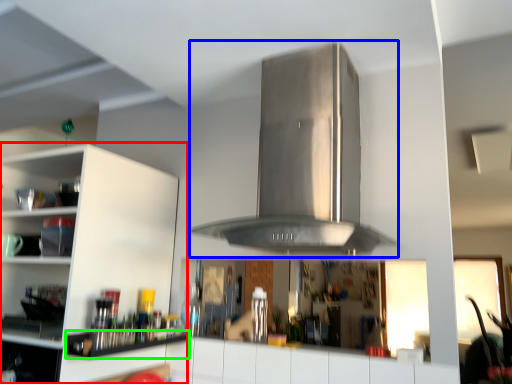
Question: Which is nearer to the cabinetry (highlighted by a red box)? vent (highlighted by a blue box) or shelf (highlighted by a green box).

Choices:
 (A) vent
 (B) shelf

Answer: (B)